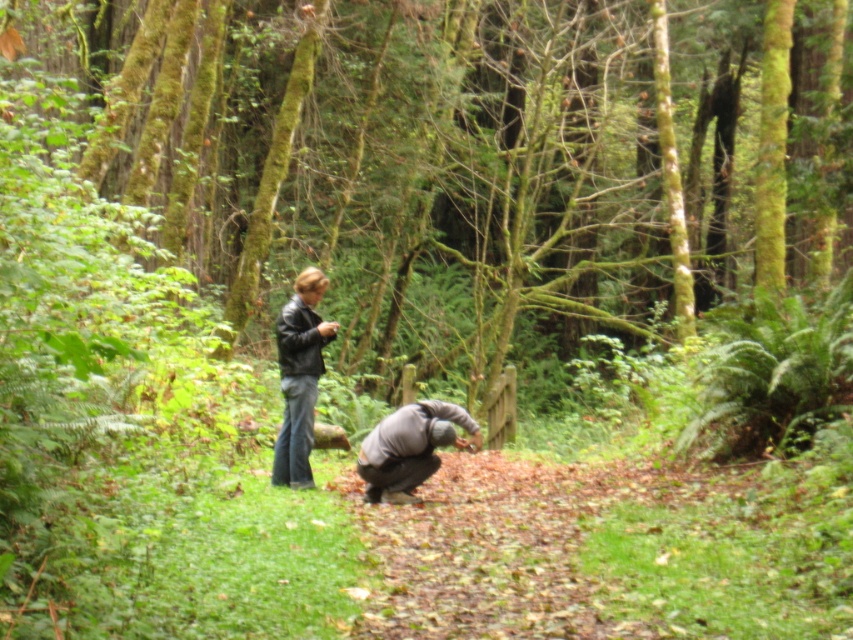
Can you confirm if matte black jacket at center is shorter than gray matte jacket at lower center?

In fact, matte black jacket at center may be taller than gray matte jacket at lower center.

Is matte black jacket at center positioned at the back of gray matte jacket at lower center?

Yes, matte black jacket at center is further from the viewer.

Image resolution: width=853 pixels, height=640 pixels. Find the location of `matte black jacket at center`. matte black jacket at center is located at coordinates (299, 376).